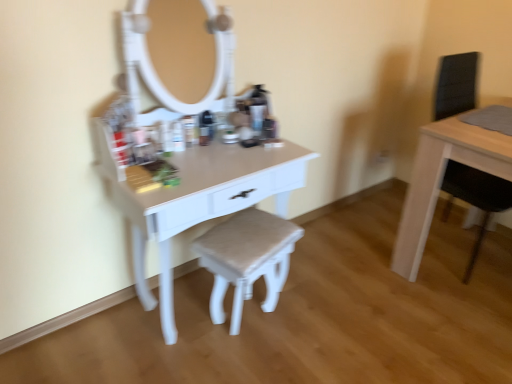
Describe the element at coordinates (247, 259) in the screenshot. The image size is (512, 384). I see `matte white stool at center` at that location.

Where is `light wood table at right, the 2th table in the left-to-right sequence`? The image size is (512, 384). light wood table at right, the 2th table in the left-to-right sequence is located at coordinates (442, 179).

This screenshot has height=384, width=512. Find the location of `white glossy table at center, marked as the 1th table in a left-to-right arrangement`. white glossy table at center, marked as the 1th table in a left-to-right arrangement is located at coordinates (197, 200).

The width and height of the screenshot is (512, 384). Identify the location of matte white stool at center. (247, 259).

Is white glossy table at center, marked as the 1th table in a left-to-right arrangement, to the left or to the right of matte white stool at center in the image?

In the image, white glossy table at center, marked as the 1th table in a left-to-right arrangement, appears on the left side of matte white stool at center.

From the image's perspective, which table is the 1st one above the matte white stool at center? Please provide its 2D coordinates.

[(197, 200)]

Is white glossy table at center, marked as the 1th table in a left-to-right arrangement, not close to matte white stool at center?

That's not correct — white glossy table at center, marked as the 1th table in a left-to-right arrangement, is a little close to matte white stool at center.

Is matte white stool at center bigger than light wood table at right, acting as the first table starting from the right?

Incorrect, matte white stool at center is not larger than light wood table at right, acting as the first table starting from the right.

Choose the correct answer: Is matte white stool at center inside light wood table at right, acting as the first table starting from the right, or outside it?

The correct answer is: outside.

Is matte white stool at center turned away from light wood table at right, acting as the first table starting from the right?

No, matte white stool at center's orientation is not away from light wood table at right, acting as the first table starting from the right.

Can you confirm if matte white stool at center is thinner than light wood table at right, the 2th table in the left-to-right sequence?

Yes.

Is white glossy table at center, which ranks as the 2th table in right-to-left order, to the right of light wood table at right, the 2th table in the left-to-right sequence, from the viewer's perspective?

Incorrect, white glossy table at center, which ranks as the 2th table in right-to-left order, is not on the right side of light wood table at right, the 2th table in the left-to-right sequence.

Is white glossy table at center, marked as the 1th table in a left-to-right arrangement, next to light wood table at right, the 2th table in the left-to-right sequence, and touching it?

No, white glossy table at center, marked as the 1th table in a left-to-right arrangement, is not beside light wood table at right, the 2th table in the left-to-right sequence.

Considering the relative sizes of white glossy table at center, which ranks as the 2th table in right-to-left order, and light wood table at right, acting as the first table starting from the right, in the image provided, is white glossy table at center, which ranks as the 2th table in right-to-left order, smaller than light wood table at right, acting as the first table starting from the right,?

Incorrect, white glossy table at center, which ranks as the 2th table in right-to-left order, is not smaller in size than light wood table at right, acting as the first table starting from the right.

Based on the photo, who is taller, white glossy table at center, marked as the 1th table in a left-to-right arrangement, or light wood table at right, the 2th table in the left-to-right sequence?

Standing taller between the two is light wood table at right, the 2th table in the left-to-right sequence.

Is light wood table at right, the 2th table in the left-to-right sequence, with matte white stool at center?

No, light wood table at right, the 2th table in the left-to-right sequence, is not in contact with matte white stool at center.

From the image's perspective, which is above, light wood table at right, acting as the first table starting from the right, or matte white stool at center?

light wood table at right, acting as the first table starting from the right, is shown above in the image.

From a real-world perspective, is light wood table at right, acting as the first table starting from the right, physically above matte white stool at center?

Yes, from a real-world perspective, light wood table at right, acting as the first table starting from the right, is above matte white stool at center.

You are a GUI agent. You are given a task and a screenshot of the screen. Output one action in this format:
    pyautogui.click(x=<x>, y=<y>)
    Task: Click on the stool below the white glossy table at center, which ranks as the 2th table in right-to-left order (from the image's perspective)
    This screenshot has height=384, width=512.
    Given the screenshot: What is the action you would take?
    pyautogui.click(x=247, y=259)

Is matte white stool at center not near white glossy table at center, marked as the 1th table in a left-to-right arrangement?

No, matte white stool at center is not far from white glossy table at center, marked as the 1th table in a left-to-right arrangement.

Looking at this image, from the image's perspective, is matte white stool at center under white glossy table at center, marked as the 1th table in a left-to-right arrangement?

Indeed, from the image's perspective, matte white stool at center is shown beneath white glossy table at center, marked as the 1th table in a left-to-right arrangement.

Considering the relative sizes of light wood table at right, acting as the first table starting from the right, and white glossy table at center, marked as the 1th table in a left-to-right arrangement, in the image provided, is light wood table at right, acting as the first table starting from the right, shorter than white glossy table at center, marked as the 1th table in a left-to-right arrangement,?

In fact, light wood table at right, acting as the first table starting from the right, may be taller than white glossy table at center, marked as the 1th table in a left-to-right arrangement.

Does point (406, 223) lie behind point (167, 275)?

Yes, point (406, 223) is behind point (167, 275).

Is light wood table at right, acting as the first table starting from the right, smaller than white glossy table at center, marked as the 1th table in a left-to-right arrangement?

Correct, light wood table at right, acting as the first table starting from the right, occupies less space than white glossy table at center, marked as the 1th table in a left-to-right arrangement.

From a real-world perspective, is light wood table at right, acting as the first table starting from the right, on top of white glossy table at center, which ranks as the 2th table in right-to-left order?

Indeed, from a real-world perspective, light wood table at right, acting as the first table starting from the right, stands above white glossy table at center, which ranks as the 2th table in right-to-left order.

At what (x,y) coordinates should I click in order to perform the action: click on the 1st table positioned above the matte white stool at center (from the image's perspective). Please return your answer as a coordinate pair (x, y). The height and width of the screenshot is (384, 512). Looking at the image, I should click on [x=197, y=200].

This screenshot has height=384, width=512. I want to click on stool that appears in front of the light wood table at right, acting as the first table starting from the right, so click(247, 259).

Considering their positions, is light wood table at right, the 2th table in the left-to-right sequence, positioned further to white glossy table at center, which ranks as the 2th table in right-to-left order, than matte white stool at center?

light wood table at right, the 2th table in the left-to-right sequence, lies further to white glossy table at center, which ranks as the 2th table in right-to-left order, than the other object.

Looking at the image, which one is located further to light wood table at right, the 2th table in the left-to-right sequence, matte white stool at center or white glossy table at center, which ranks as the 2th table in right-to-left order?

The object further to light wood table at right, the 2th table in the left-to-right sequence, is white glossy table at center, which ranks as the 2th table in right-to-left order.

Which object lies nearer to the anchor point light wood table at right, the 2th table in the left-to-right sequence, white glossy table at center, marked as the 1th table in a left-to-right arrangement, or matte white stool at center?

matte white stool at center lies closer to light wood table at right, the 2th table in the left-to-right sequence, than the other object.

In the scene shown: Looking at the image, which one is located further to white glossy table at center, which ranks as the 2th table in right-to-left order, matte white stool at center or light wood table at right, the 2th table in the left-to-right sequence?

light wood table at right, the 2th table in the left-to-right sequence, is positioned further to the anchor white glossy table at center, which ranks as the 2th table in right-to-left order.

Based on their spatial positions, is white glossy table at center, marked as the 1th table in a left-to-right arrangement, or light wood table at right, acting as the first table starting from the right, closer to matte white stool at center?

white glossy table at center, marked as the 1th table in a left-to-right arrangement, is positioned closer to the anchor matte white stool at center.

In the scene shown: Considering their positions, is light wood table at right, the 2th table in the left-to-right sequence, positioned further to matte white stool at center than white glossy table at center, which ranks as the 2th table in right-to-left order?

The object further to matte white stool at center is light wood table at right, the 2th table in the left-to-right sequence.

The image size is (512, 384). I want to click on stool between white glossy table at center, marked as the 1th table in a left-to-right arrangement, and light wood table at right, acting as the first table starting from the right, so click(247, 259).